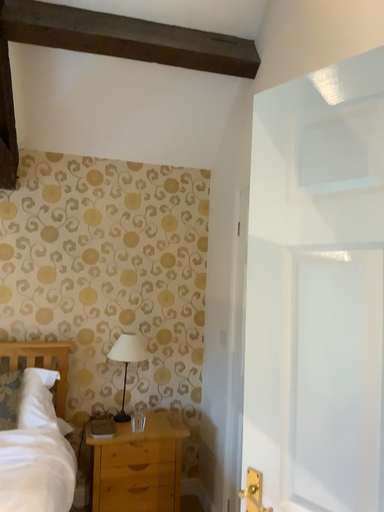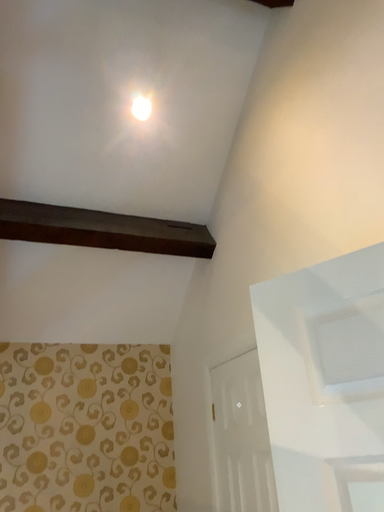
Question: How did the camera likely rotate when shooting the video?

Choices:
 (A) rotated downward
 (B) rotated upward

Answer: (B)